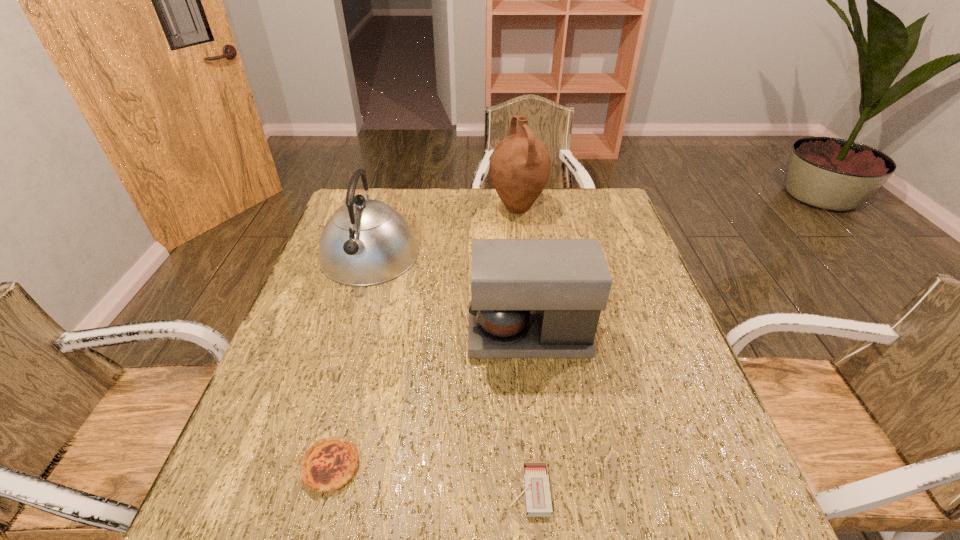
Locate an element on the screen. This screenshot has height=540, width=960. free space located on the carafe side of the third farthest object is located at coordinates (435, 335).

Locate an element on the screen. The height and width of the screenshot is (540, 960). free space located on the striking surface of the matchbox is located at coordinates (389, 491).

Identify the location of vacant space located on the striking surface of the matchbox. This screenshot has width=960, height=540. (474, 491).

Image resolution: width=960 pixels, height=540 pixels. What are the coordinates of `vacant space located 0.390m on the striking surface of the matchbox` in the screenshot? It's located at (286, 491).

Find the location of `vacant area located 0.190m on the right of the quiche`. vacant area located 0.190m on the right of the quiche is located at coordinates (463, 467).

Find the location of a particular element. pitcher at the far edge is located at coordinates (520, 165).

Where is `kettle that is at the far edge`? kettle that is at the far edge is located at coordinates (365, 242).

Find the location of a particular element. The image size is (960, 540). matchbox positioned at the near edge is located at coordinates coord(538,503).

Image resolution: width=960 pixels, height=540 pixels. In order to click on quiche that is at the near edge in this screenshot , I will do `click(328, 465)`.

Where is `kettle situated at the left edge`? kettle situated at the left edge is located at coordinates (365, 242).